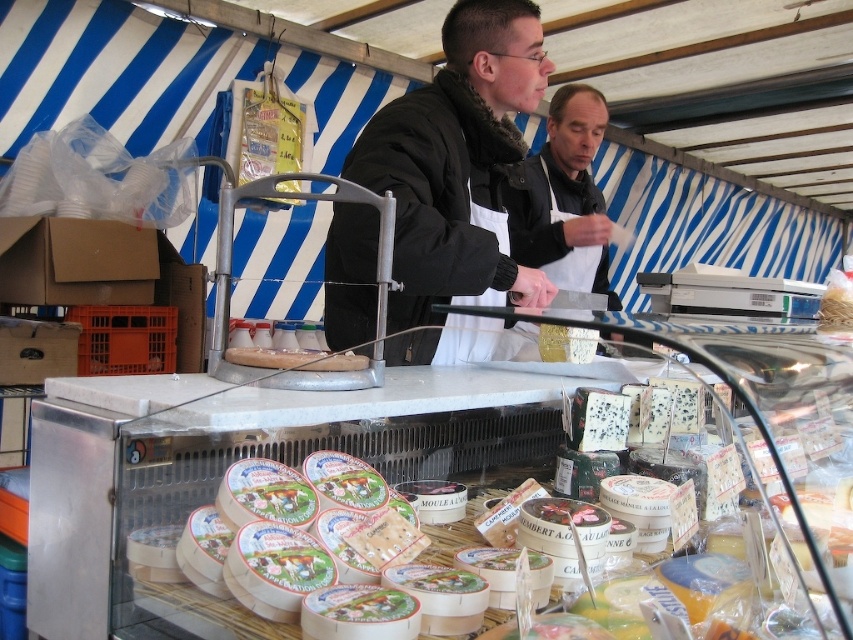
Does point (149, 442) come behind point (426, 321)?

That is False.

Between white creamy cheese at center and black matte jacket at center, which one has less height?

white creamy cheese at center

Find the location of `white creamy cheese at center`. white creamy cheese at center is located at coordinates (303, 472).